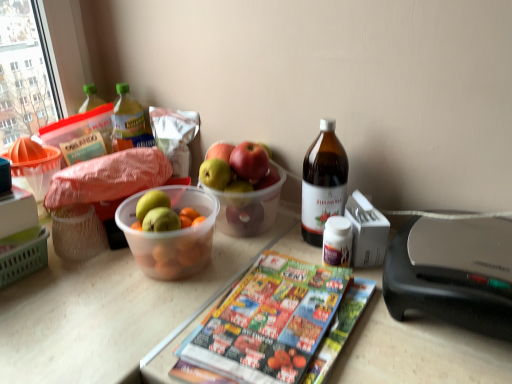
Question: Should I look upward or downward to see printed paper magazine at center?

Choices:
 (A) up
 (B) down

Answer: (B)

Question: Can you confirm if translucent plastic bottle at upper left, the 1th bottle in the top-to-bottom sequence, is bigger than brown glass bottle at upper right, the first bottle when ordered from right to left?

Choices:
 (A) no
 (B) yes

Answer: (A)

Question: Is translucent plastic bottle at upper left, the second bottle positioned from the right, to the right of brown glass bottle at upper right, which ranks as the 1th bottle in front-to-back order, from the viewer's perspective?

Choices:
 (A) yes
 (B) no

Answer: (B)

Question: Is translucent plastic bottle at upper left, the second bottle positioned from the right, outside brown glass bottle at upper right, the second bottle viewed from the left?

Choices:
 (A) no
 (B) yes

Answer: (B)

Question: Could you tell me if translucent plastic bottle at upper left, which ranks as the second bottle in bottom-to-top order, is turned towards brown glass bottle at upper right, which ranks as the 1th bottle in front-to-back order?

Choices:
 (A) no
 (B) yes

Answer: (B)

Question: Is translucent plastic bottle at upper left, which is the first bottle in back-to-front order, not near brown glass bottle at upper right, which is the 1th bottle in bottom-to-top order?

Choices:
 (A) no
 (B) yes

Answer: (A)

Question: Is translucent plastic bottle at upper left, which is the first bottle in back-to-front order, touching brown glass bottle at upper right, the first bottle when ordered from right to left?

Choices:
 (A) yes
 (B) no

Answer: (B)

Question: Does brown glass bottle at upper right, which ranks as the 1th bottle in front-to-back order, have a larger size compared to green matte grapefruit at center?

Choices:
 (A) yes
 (B) no

Answer: (B)

Question: Does brown glass bottle at upper right, the second bottle viewed from the top, have a greater height compared to green matte grapefruit at center?

Choices:
 (A) yes
 (B) no

Answer: (A)

Question: Is brown glass bottle at upper right, the second bottle positioned from the back, further to camera compared to green matte grapefruit at center?

Choices:
 (A) yes
 (B) no

Answer: (B)

Question: Is the surface of brown glass bottle at upper right, which is the 1th bottle in bottom-to-top order, in direct contact with green matte grapefruit at center?

Choices:
 (A) no
 (B) yes

Answer: (A)

Question: Does brown glass bottle at upper right, the second bottle viewed from the left, lie in front of green matte grapefruit at center?

Choices:
 (A) no
 (B) yes

Answer: (B)

Question: From a real-world perspective, does brown glass bottle at upper right, the second bottle viewed from the left, sit lower than green matte grapefruit at center?

Choices:
 (A) no
 (B) yes

Answer: (A)

Question: Considering the relative sizes of printed paper magazine at center and translucent plastic bottle at upper left, the second bottle positioned from the right, in the image provided, is printed paper magazine at center smaller than translucent plastic bottle at upper left, the second bottle positioned from the right,?

Choices:
 (A) no
 (B) yes

Answer: (A)